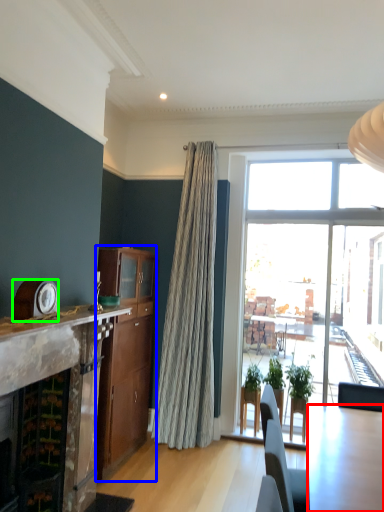
Question: Based on their relative distances, which object is nearer to kitchen & dining room table (highlighted by a red box)? Choose from cabinetry (highlighted by a blue box) and clock (highlighted by a green box).

Choices:
 (A) cabinetry
 (B) clock

Answer: (B)